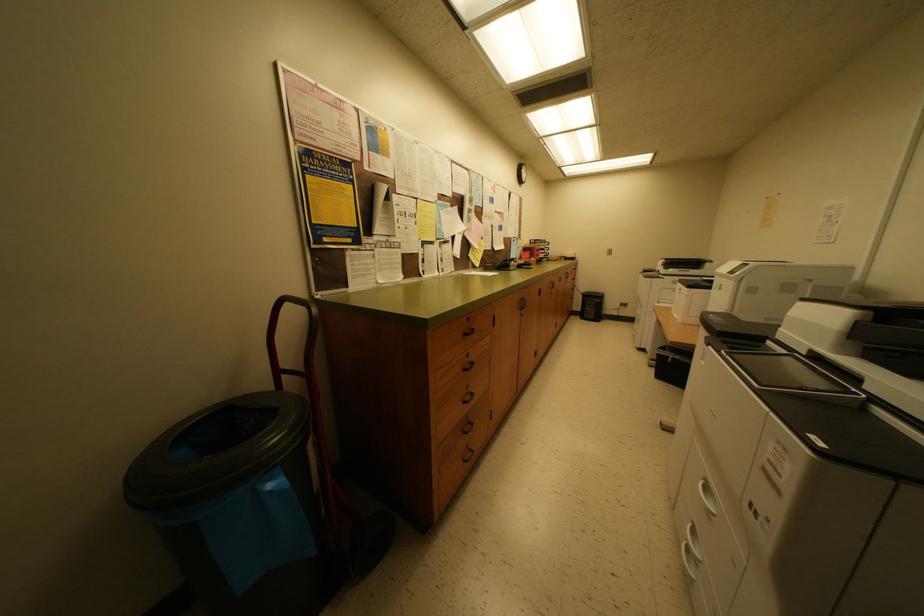
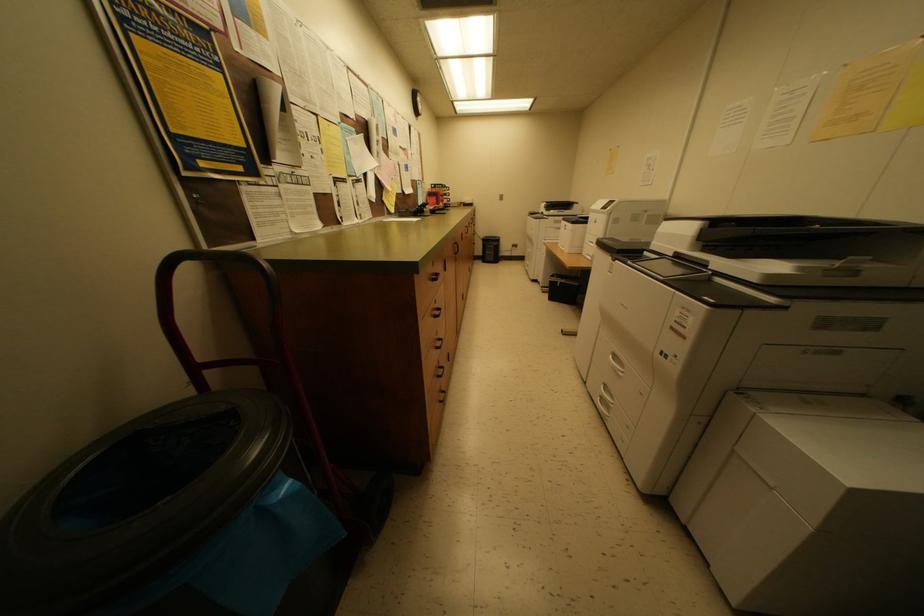
Question: The camera is either moving clockwise (left) or counter-clockwise (right) around the object. The first image is from the beginning of the video and the second image is from the end. Is the camera moving left or right when shooting the video?

Choices:
 (A) Left
 (B) Right

Answer: (A)